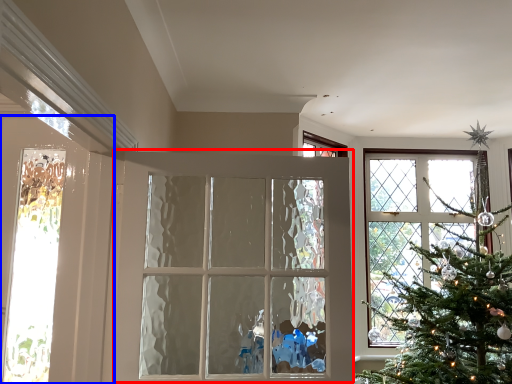
Question: Among these objects, which one is nearest to the camera, door (highlighted by a red box) or door (highlighted by a blue box)?

Choices:
 (A) door
 (B) door

Answer: (A)